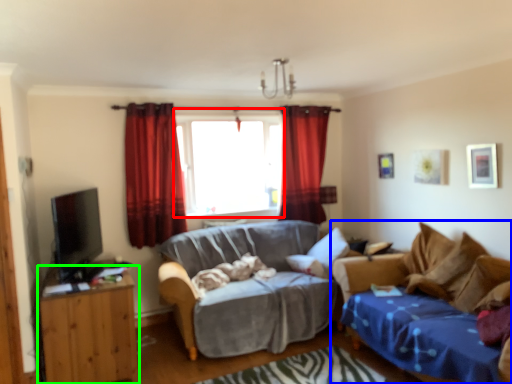
Question: Which object is positioned closest to window (highlighted by a red box)? Select from studio couch (highlighted by a blue box) and cabinetry (highlighted by a green box).

Choices:
 (A) studio couch
 (B) cabinetry

Answer: (B)